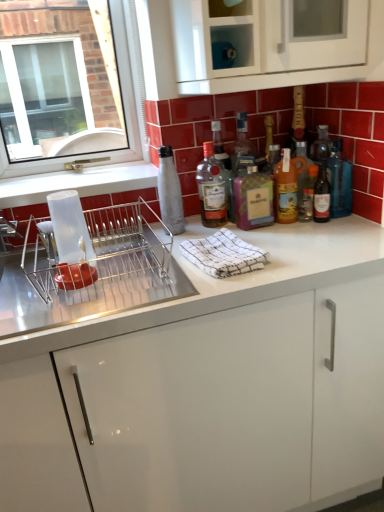
Question: From their relative heights in the image, would you say metallic silver dish rack at left is taller or shorter than white glossy cabinet at upper center, the 2th cabinetry ordered from the bottom?

Choices:
 (A) tall
 (B) short

Answer: (B)

Question: Considering the positions of point (77, 280) and point (360, 72), is point (77, 280) closer or farther from the camera than point (360, 72)?

Choices:
 (A) closer
 (B) farther

Answer: (A)

Question: Estimate the real-world distances between objects in this image. Which object is closer to the metallic silver dish rack at left?

Choices:
 (A) white textured cloth at center
 (B) translucent glass bottles at center, the 2th bottle viewed from the right
 (C) matte glass bottle at center, acting as the 5th bottle starting from the right
 (D) translucent amber bottle at center, placed as the third bottle when sorted from right to left
 (E) matte glass wine bottle at center-right

Answer: (A)

Question: Which object is the farthest from the white glossy cabinet at center, arranged as the first cabinetry when ordered from the bottom?

Choices:
 (A) translucent amber bottle at center, which appears as the fourth bottle when viewed from the left
 (B) white textured cloth at center
 (C) translucent glass bottles at center, the 5th bottle from the left
 (D) translucent glass bottle at right, the sixth bottle when ordered from left to right
 (E) white glass bottle at center, the 6th bottle in the right-to-left sequence

Answer: (D)